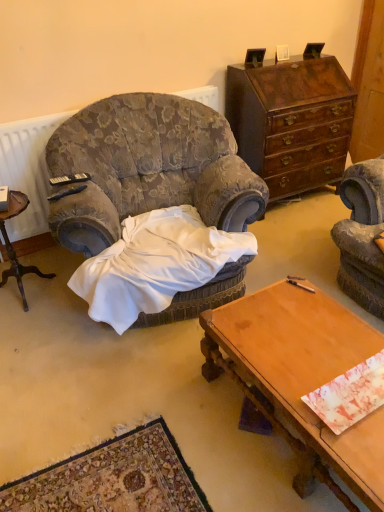
Find the location of a particular element. The image size is (384, 512). vacant area that lies between wooden nightstand at left and velvet-patterned armchair at center is located at coordinates (44, 317).